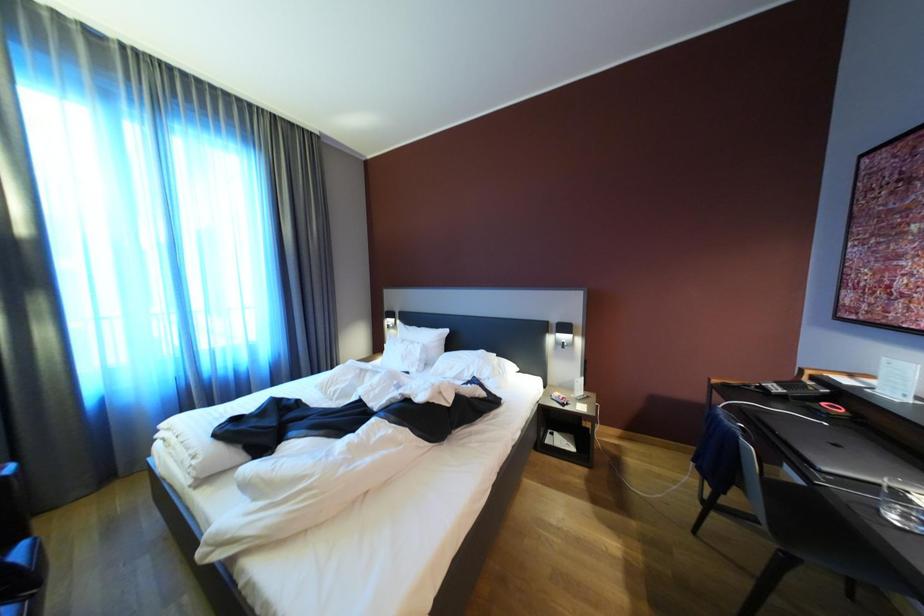
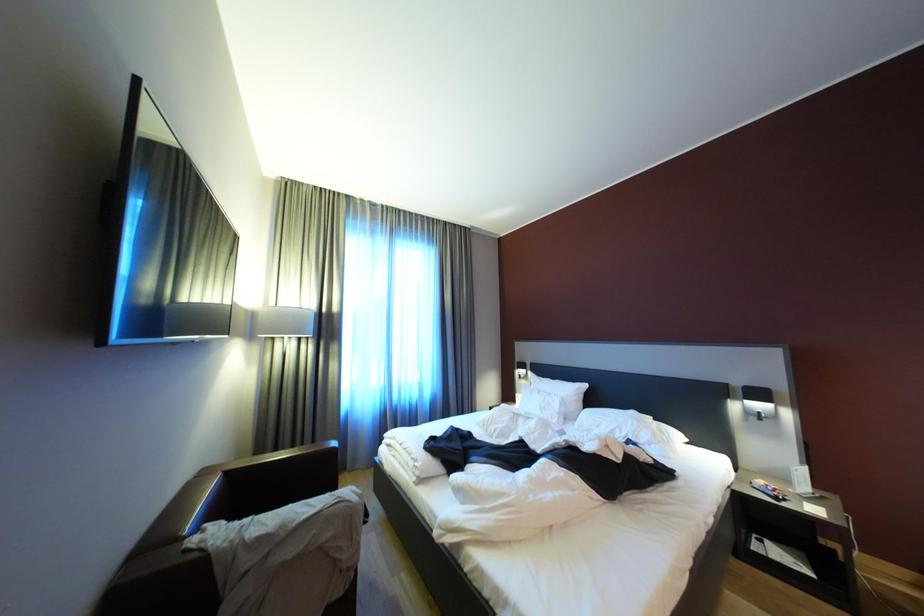
The images are taken continuously from a first-person perspective. In which direction are you moving?

The movement direction of the cameraman is left, backward.